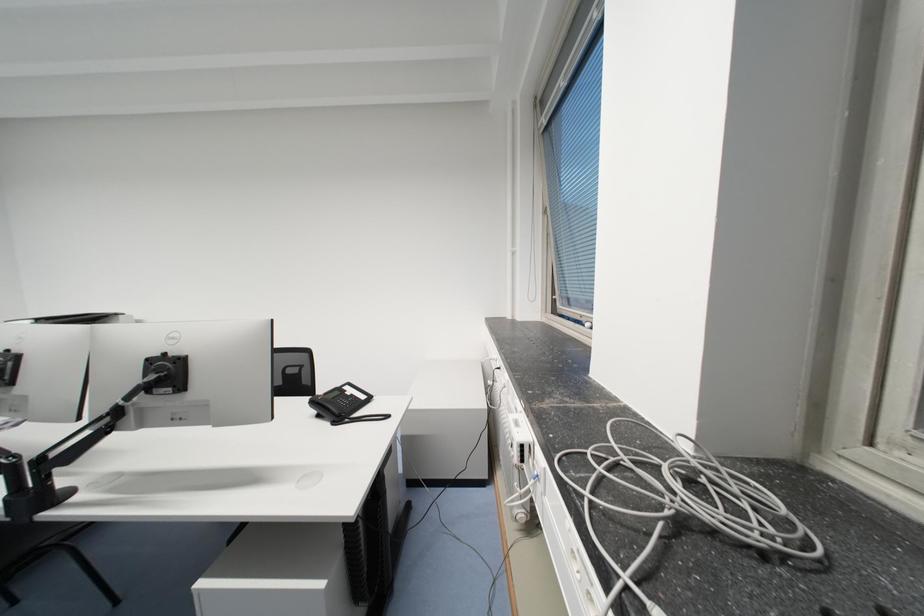
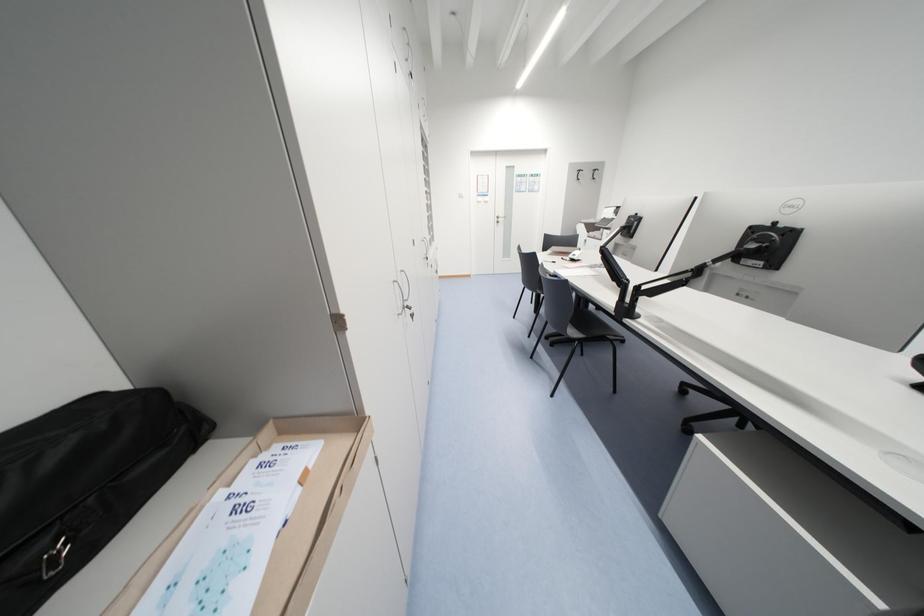
First-person continuous shooting, in which direction is the camera rotating?

The camera's rotation is toward left-down.